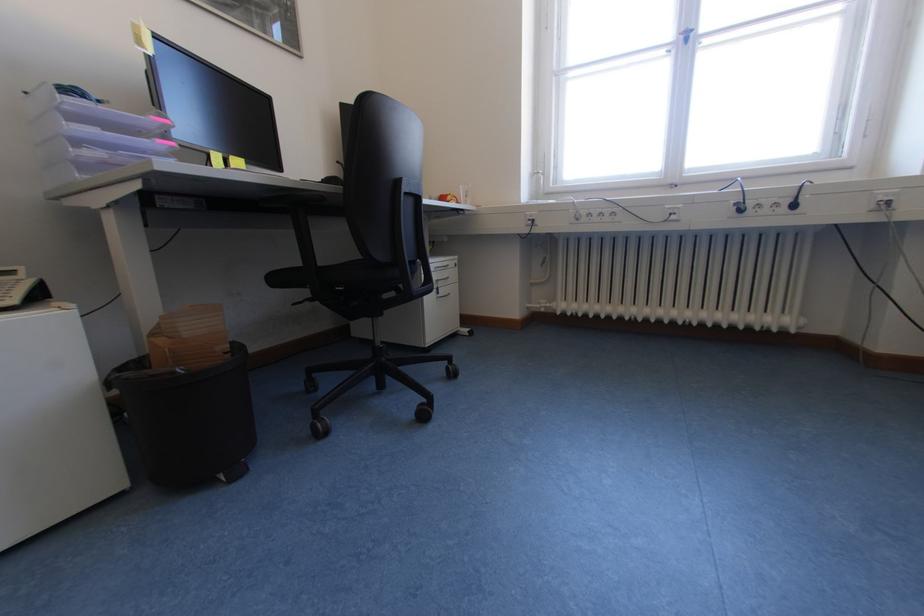
The image size is (924, 616). Identify the location of radiator valve. (542, 308).